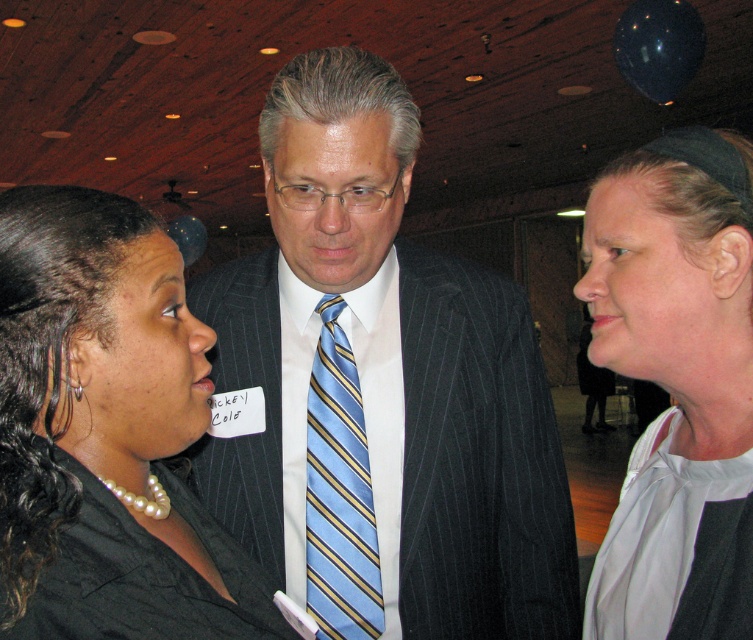
Is black satin blazer at center shorter than blue striped tie at center?

Yes, black satin blazer at center is shorter than blue striped tie at center.

Who is more forward, [127,324] or [337,592]?

Point [127,324]

Identify the location of black satin blazer at center. The width and height of the screenshot is (753, 640). (104, 435).

Consider the image. Can you confirm if dark gray pinstripe suit at center is shorter than white fabric at center?

No, dark gray pinstripe suit at center is not shorter than white fabric at center.

Can you confirm if dark gray pinstripe suit at center is bigger than white fabric at center?

Correct, dark gray pinstripe suit at center is larger in size than white fabric at center.

The width and height of the screenshot is (753, 640). Identify the location of dark gray pinstripe suit at center. (380, 388).

Where is `dark gray pinstripe suit at center`? The width and height of the screenshot is (753, 640). dark gray pinstripe suit at center is located at coordinates (380, 388).

Is dark gray pinstripe suit at center to the left of blue striped tie at center from the viewer's perspective?

Incorrect, dark gray pinstripe suit at center is not on the left side of blue striped tie at center.

Find the location of a particular element. Image resolution: width=753 pixels, height=640 pixels. dark gray pinstripe suit at center is located at coordinates (380, 388).

Does point (297, 540) lie behind point (351, 371)?

No, (297, 540) is closer to viewer.

Where is `dark gray pinstripe suit at center`? This screenshot has height=640, width=753. dark gray pinstripe suit at center is located at coordinates (380, 388).